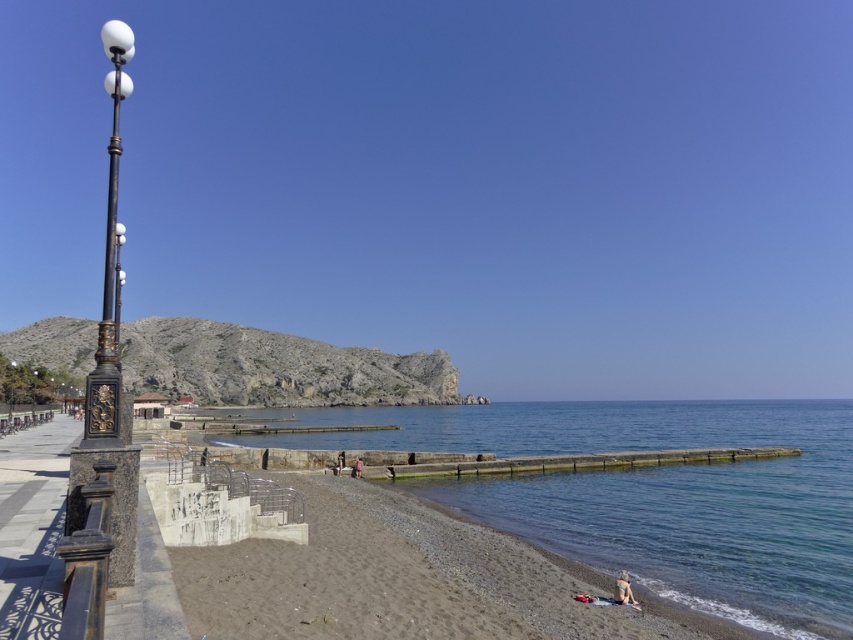
Question: Does clear blue water at lower right lie behind dark brown stone railing at left?

Choices:
 (A) no
 (B) yes

Answer: (B)

Question: Does pink fabric at lower center appear on the right side of tan skin person at lower center?

Choices:
 (A) yes
 (B) no

Answer: (A)

Question: Which object is the closest to the pink fabric at lower center?

Choices:
 (A) clear blue water at lower right
 (B) dark brown stone railing at left
 (C) beige fabric towel at lower right
 (D) tan skin person at lower center

Answer: (D)

Question: Which point is farther from the camera taking this photo?

Choices:
 (A) (361, 465)
 (B) (48, 579)
 (C) (614, 595)

Answer: (A)

Question: Can you confirm if dark brown stone railing at left is bigger than pink fabric at lower center?

Choices:
 (A) no
 (B) yes

Answer: (B)

Question: Which of these objects is positioned farthest from the pink fabric at lower center?

Choices:
 (A) dark brown stone railing at left
 (B) clear blue water at lower right

Answer: (B)